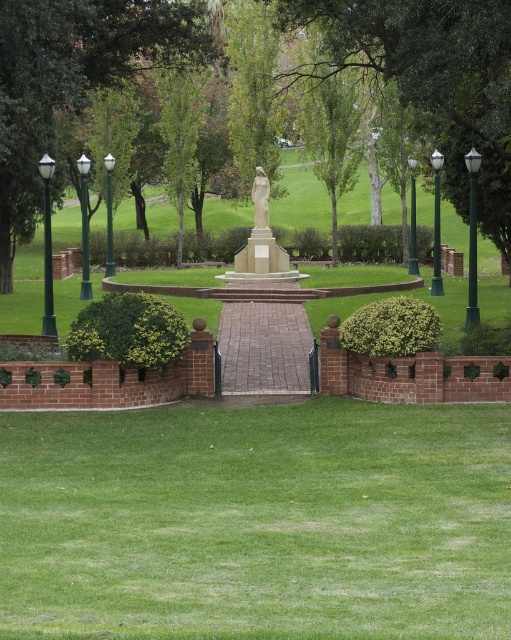
Question: Among these objects, which one is nearest to the camera?

Choices:
 (A) green metallic lamp post at left
 (B) white marble statue at center
 (C) green metallic lamp post at right
 (D) green metal lamp post at left

Answer: (A)

Question: From the image, what is the correct spatial relationship of green metallic lamp post at left in relation to green metallic lamp post at right?

Choices:
 (A) right
 (B) left

Answer: (B)

Question: Which is nearer to the green metal lamp post at left?

Choices:
 (A) green metal lamp post at upper center
 (B) green glass lamp post at left

Answer: (B)

Question: Considering the relative positions of white marble statue at center and green glass lamp post at left in the image provided, where is white marble statue at center located with respect to green glass lamp post at left?

Choices:
 (A) above
 (B) below

Answer: (B)

Question: Which object appears farthest from the camera in this image?

Choices:
 (A) green glass lamp post at left
 (B) green leafy tree at left

Answer: (A)

Question: Does green metallic lamp post at left come behind green metal lamp post at upper center?

Choices:
 (A) no
 (B) yes

Answer: (A)